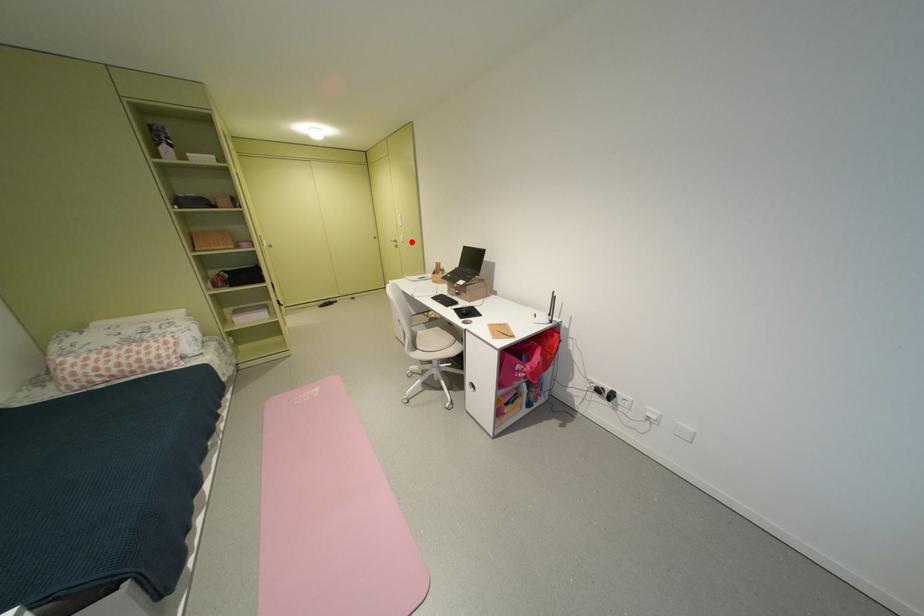
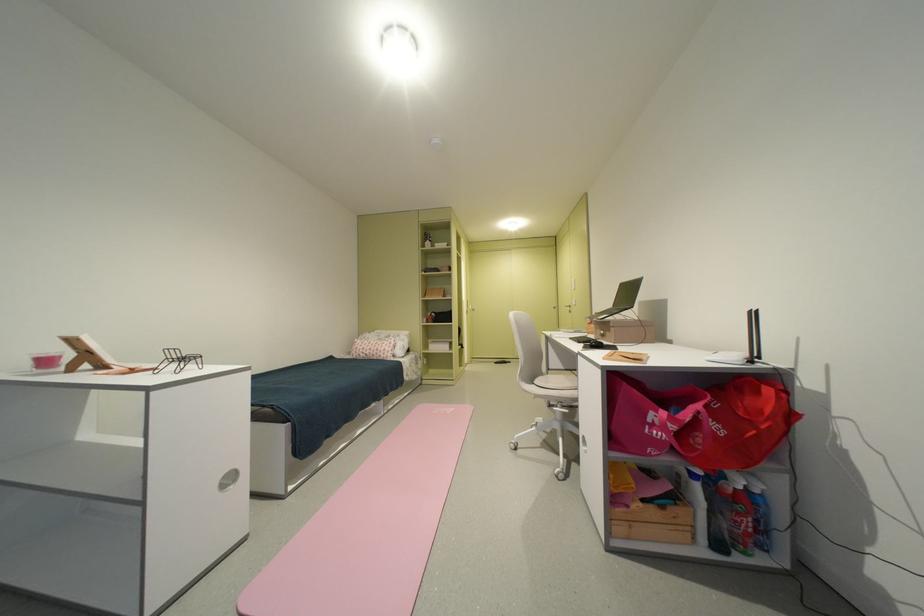
Locate, in the second image, the point that corresponds to the highlighted location in the first image.

(584, 305)